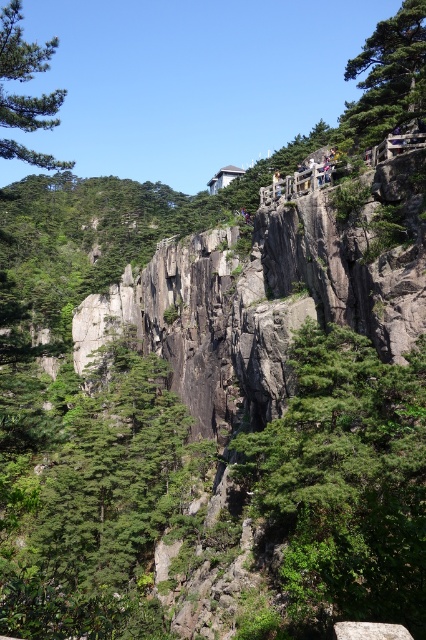
In the scene shown: Is green textured rock at center above green matte tree at upper left?

No, green textured rock at center is not above green matte tree at upper left.

Does point (345, 404) come farther from viewer compared to point (23, 131)?

No.

Does point (345, 332) lie in front of point (32, 108)?

No, (345, 332) is further to viewer.

The image size is (426, 640). Find the location of `green textured rock at center`. green textured rock at center is located at coordinates (347, 480).

Is green matte tree at center below green matte tree at upper left?

Indeed, green matte tree at center is positioned under green matte tree at upper left.

At what (x,y) coordinates should I click in order to perform the action: click on green matte tree at center. Please return your answer as a coordinate pair (x, y). The width and height of the screenshot is (426, 640). Looking at the image, I should click on (106, 509).

Who is more distant from viewer, [307,397] or [86,595]?

Point [86,595]

Is green textured rock at center closer to the viewer compared to green matte tree at center?

Yes, it is in front of green matte tree at center.

This screenshot has height=640, width=426. Identify the location of green textured rock at center. (347, 480).

This screenshot has height=640, width=426. What are the coordinates of `green textured rock at center` in the screenshot? It's located at (347, 480).